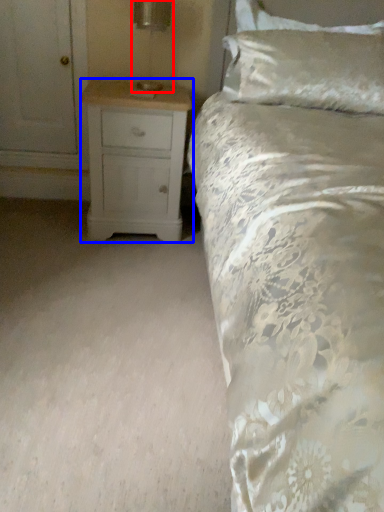
Question: Which object appears closest to the camera in this image, table lamp (highlighted by a red box) or chest of drawers (highlighted by a blue box)?

Choices:
 (A) table lamp
 (B) chest of drawers

Answer: (B)